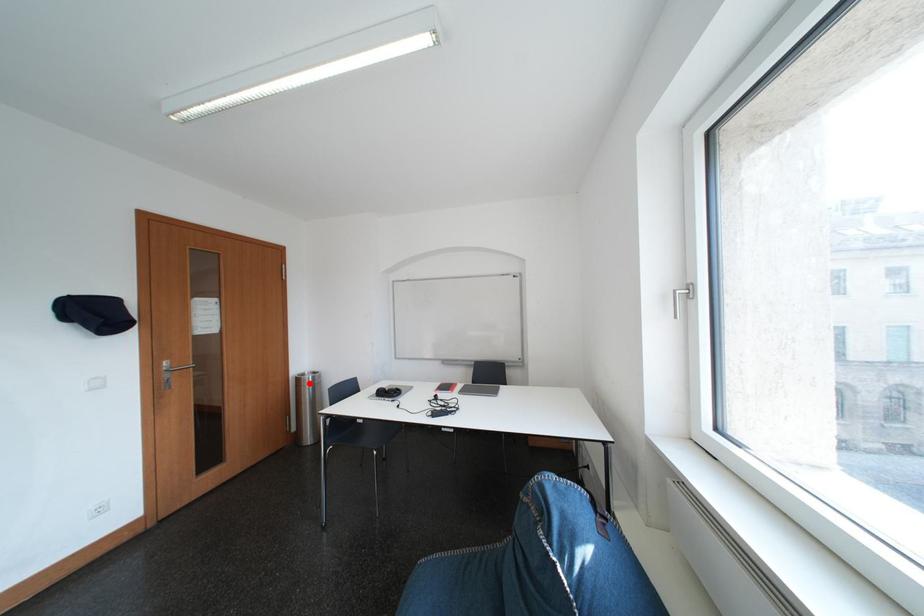
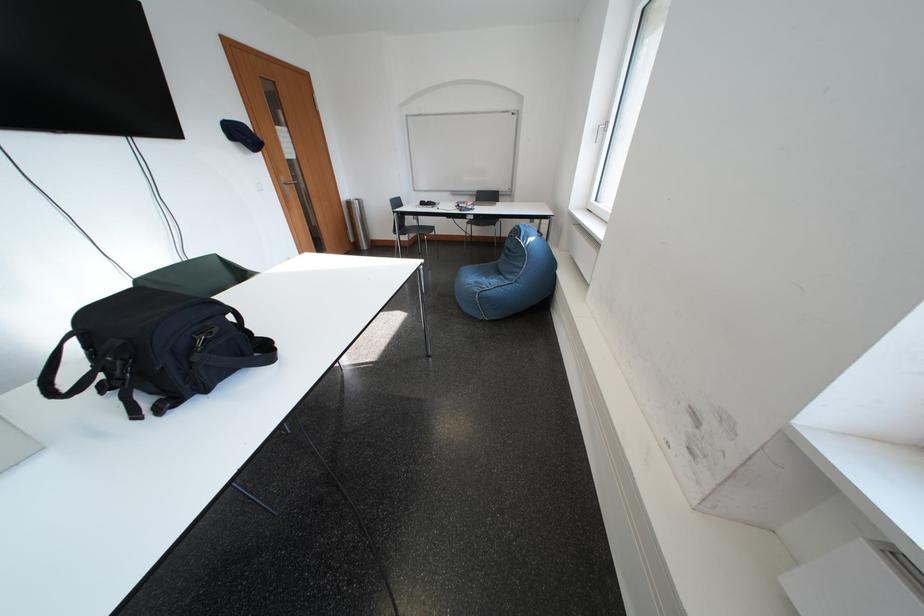
Question: I am providing you with two images of the same scene from different viewpoints. Image1 has a red point marked. In image2, the corresponding 3D location appears at what relative position? Reply with the corresponding letter.

Choices:
 (A) Closer
 (B) Farther

Answer: (A)